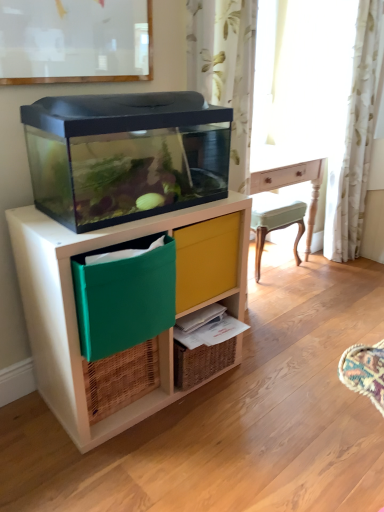
Identify the location of free space that is in between white floral fabric curtain at right and woven wood shelf at lower center. Image resolution: width=384 pixels, height=512 pixels. (296, 298).